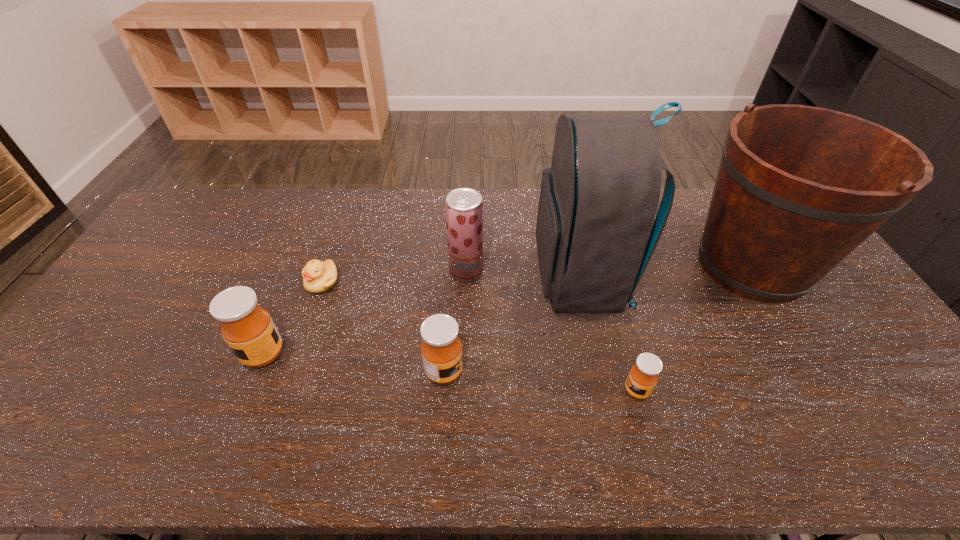
This screenshot has height=540, width=960. In order to click on free space between the second shortest object and the third tallest object in this screenshot , I will do `click(552, 331)`.

This screenshot has height=540, width=960. Find the location of `free space between the bucket and the shortest object`. free space between the bucket and the shortest object is located at coordinates (537, 274).

This screenshot has width=960, height=540. I want to click on vacant region between the fifth shortest object and the sixth tallest object, so click(552, 331).

This screenshot has height=540, width=960. In order to click on vacant region between the sixth shortest object and the backpack in this screenshot , I will do `click(666, 272)`.

This screenshot has height=540, width=960. What are the coordinates of `free space between the third shortest object and the rightmost object` in the screenshot? It's located at (598, 319).

This screenshot has height=540, width=960. I want to click on vacant region between the leftmost honey and the second honey from left to right, so click(353, 363).

Find the location of `free space between the shortest object and the fruit juice`. free space between the shortest object and the fruit juice is located at coordinates (394, 276).

You are a GUI agent. You are given a task and a screenshot of the screen. Output one action in this format:
    pyautogui.click(x=<x>, y=<y>)
    Task: Click on the vacant region between the third shortest object and the sixth shortest object
    
    Given the screenshot: What is the action you would take?
    pyautogui.click(x=598, y=319)

The image size is (960, 540). Identify the location of free space between the backpack and the rightmost honey. (609, 335).

Where is `free point between the bucket and the tallest object`? free point between the bucket and the tallest object is located at coordinates [x=666, y=272].